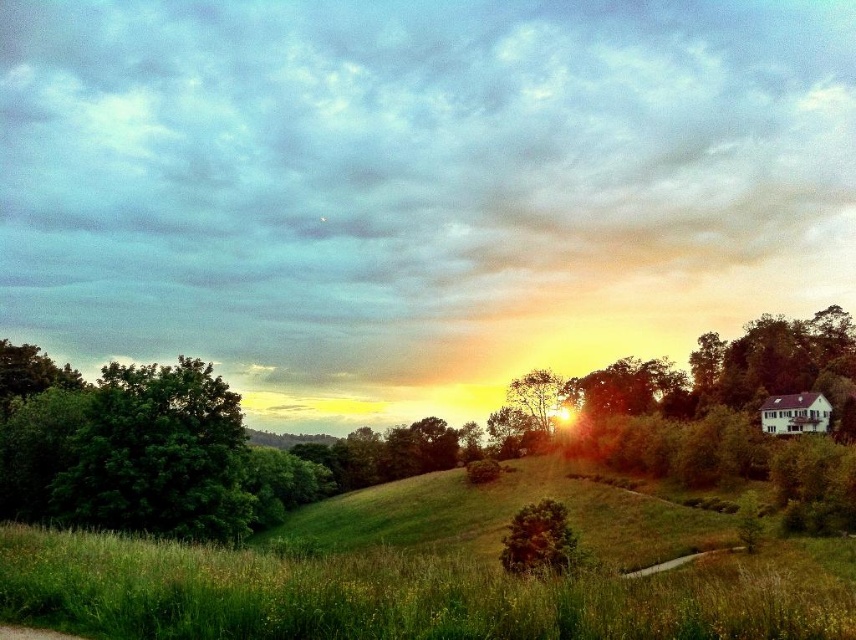
You are standing at the bottom of the grassy hill and want to walk directly towards the green leafy tree at center. Based on the path shown in the image, will you need to walk along the path or can you walk straight through the grass?

The path winds towards the right side of the image, while the green leafy tree at center is located at point (453, 436). Since the path is winding to the right, you would need to walk straight through the grass to reach the tree directly rather than following the path.

You are standing at the point closest to the horizon in the image. Which of the two points, point (373,445) or point (153,529), is farther away from you?

Point (373,445) is farther away from you because it is positioned behind point (153,529) in the scene.